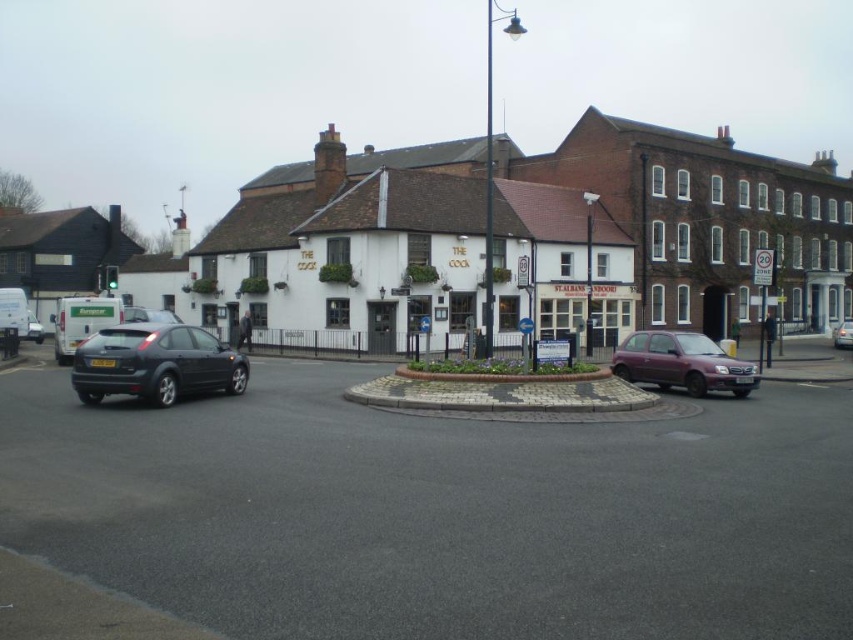
You are a delivery driver who needs to park your purple metallic hatchback at lower right near the pub named The Cock. The parking spot you want is at point [682,362]. Is your car currently at that parking spot?

The purple metallic hatchback at lower right is located at point [682,362], so yes, the car is currently at the desired parking spot.

You are a delivery person needing to park your 2.5 meters wide van next to the silver metallic car at center and the matte black car at left. Can your van fit between them if there is enough space?

The silver metallic car at center is wider than the matte black car at left, but the question is about fitting a van between them. Without specific spacing details between the cars, we cannot determine if there is enough space for the 2.5 meters wide van. More information about the distance between the cars is needed.

You are a pedestrian standing on the sidewalk near the pub. You see the black asphalt at center and the matte black hatchback at left. Which object is closer to the ground?

The black asphalt at center is located below the matte black hatchback at left, so the black asphalt at center is closer to the ground.